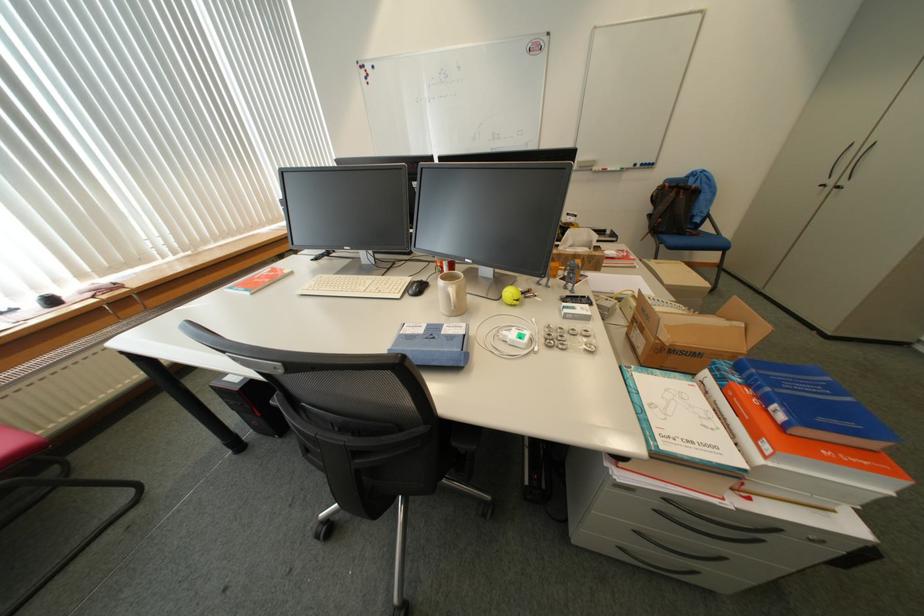
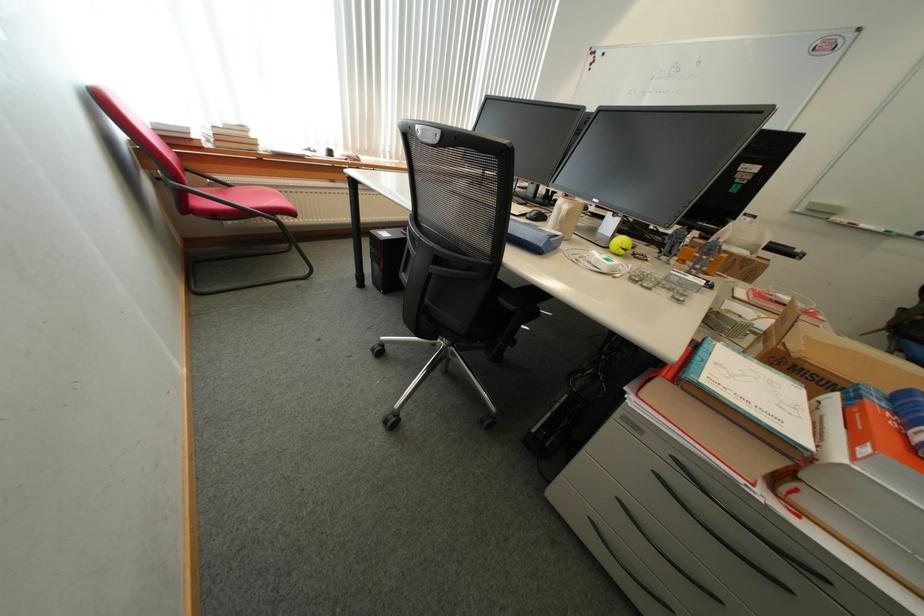
Locate, in the second image, the point that corresponds to pixel 759 387 in the first image.

(906, 415)